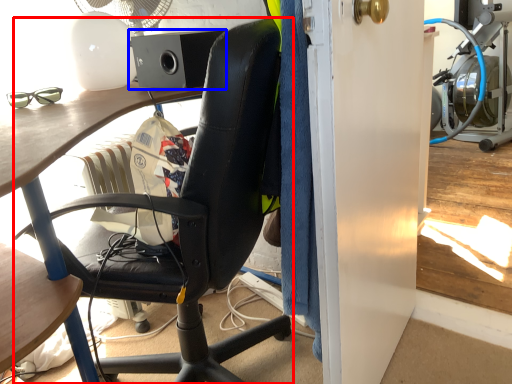
Question: Which point is further to the camera, chair (highlighted by a red box) or loudspeaker (highlighted by a blue box)?

Choices:
 (A) chair
 (B) loudspeaker

Answer: (B)